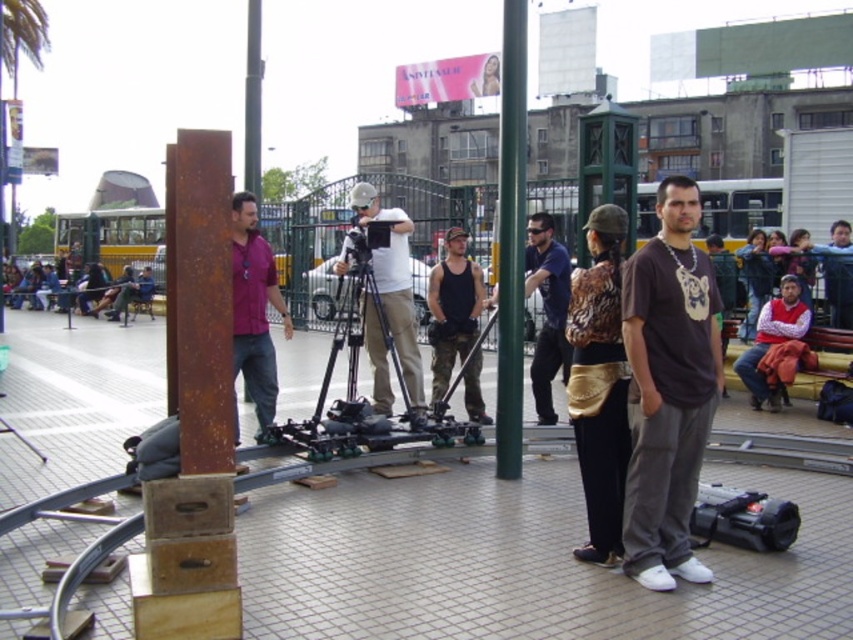
Question: Among these points, which one is nearest to the camera?

Choices:
 (A) (775, 518)
 (B) (503, 410)
 (C) (390, 410)

Answer: (A)

Question: In this image, where is matte purple shirt at center located relative to tank top at center?

Choices:
 (A) above
 (B) below

Answer: (A)

Question: Can you confirm if dark blue shirt at center is thinner than black rubber camera at lower right?

Choices:
 (A) yes
 (B) no

Answer: (A)

Question: Which of the following is the farthest from the observer?

Choices:
 (A) green matte pole at center
 (B) black rubber camera at lower right

Answer: (A)

Question: Can you confirm if matte white camera at center is bigger than matte purple shirt at center?

Choices:
 (A) yes
 (B) no

Answer: (A)

Question: Among these points, which one is nearest to the camera?

Choices:
 (A) (207, 330)
 (B) (244, 248)
 (C) (799, 320)

Answer: (A)